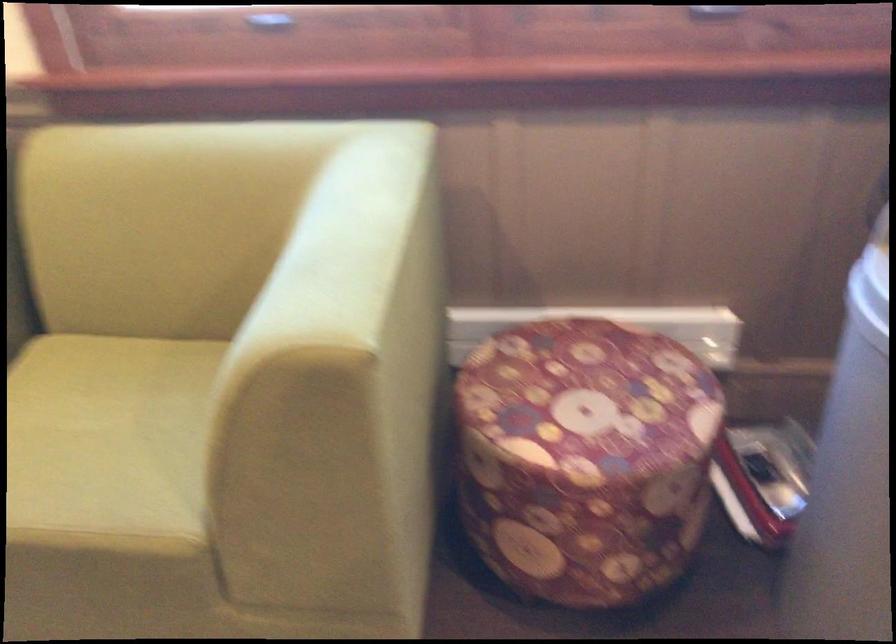
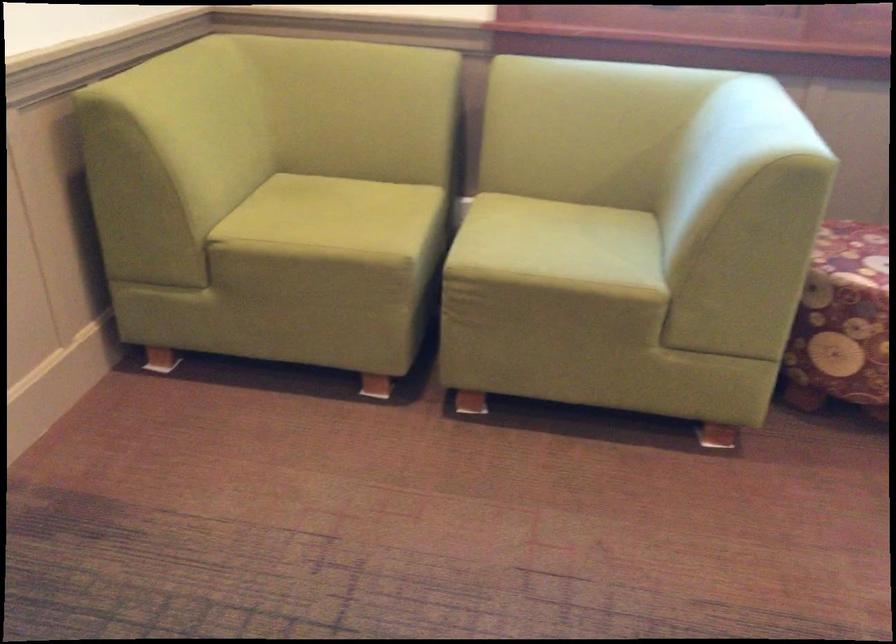
What movement of the cameraman would produce the second image?

The cameraman moved toward left, backward.